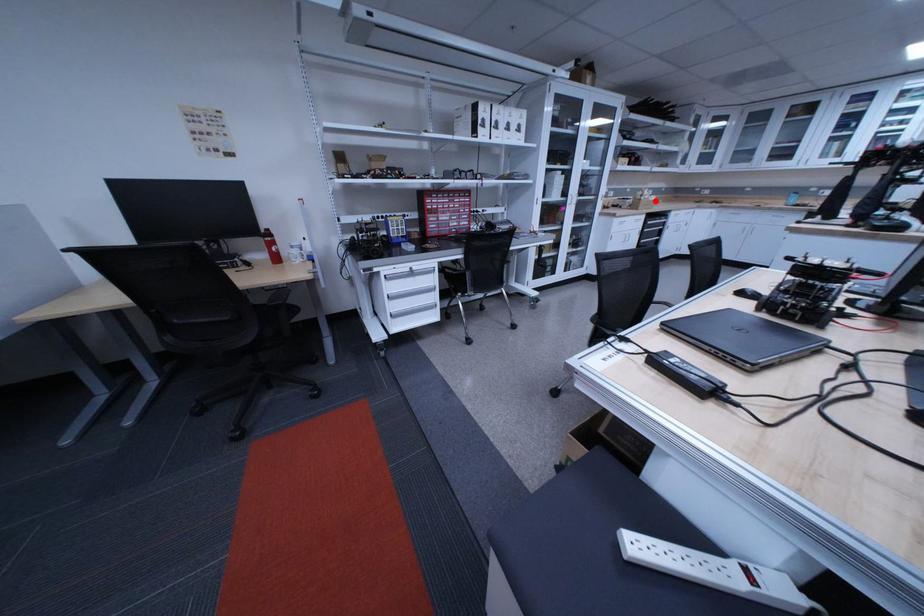
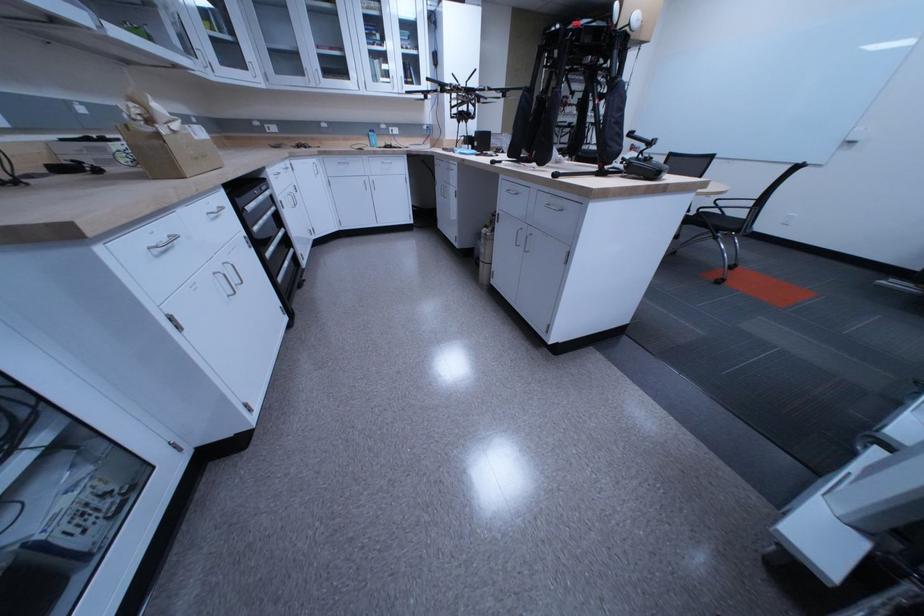
The point at the highlighted location is marked in the first image. Where is the corresponding point in the second image?

(174, 137)